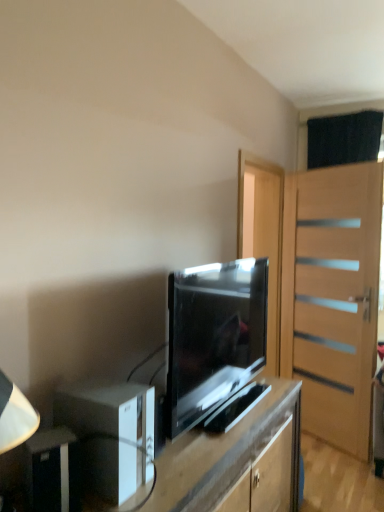
Question: From a real-world perspective, is light brown wooden door at right below matte black tv at center?

Choices:
 (A) no
 (B) yes

Answer: (B)

Question: From the image's perspective, would you say light brown wooden door at right is shown under matte black tv at center?

Choices:
 (A) yes
 (B) no

Answer: (A)

Question: Considering the relative sizes of light brown wooden door at right and matte black tv at center in the image provided, is light brown wooden door at right thinner than matte black tv at center?

Choices:
 (A) yes
 (B) no

Answer: (A)

Question: From a real-world perspective, is light brown wooden door at right positioned over matte black tv at center based on gravity?

Choices:
 (A) no
 (B) yes

Answer: (A)

Question: Is light brown wooden door at right at the left side of matte black tv at center?

Choices:
 (A) yes
 (B) no

Answer: (B)

Question: Is point (79, 504) positioned closer to the camera than point (215, 365)?

Choices:
 (A) farther
 (B) closer

Answer: (B)

Question: In terms of width, does black plastic speaker at lower left, arranged as the second appliance when viewed from the back, look wider or thinner when compared to matte black tv at center?

Choices:
 (A) thin
 (B) wide

Answer: (A)

Question: From a real-world perspective, is black plastic speaker at lower left, the first appliance viewed from the front, above or below matte black tv at center?

Choices:
 (A) below
 (B) above

Answer: (A)

Question: Is black plastic speaker at lower left, the first appliance viewed from the front, taller or shorter than matte black tv at center?

Choices:
 (A) short
 (B) tall

Answer: (A)

Question: From the image's perspective, is matte black tv stand at center above or below black plastic speaker at lower left, arranged as the second appliance when viewed from the back?

Choices:
 (A) above
 (B) below

Answer: (B)

Question: Choose the correct answer: Is matte black tv stand at center inside black plastic speaker at lower left, the first appliance viewed from the front, or outside it?

Choices:
 (A) outside
 (B) inside

Answer: (A)

Question: Is matte black tv stand at center in front of or behind black plastic speaker at lower left, arranged as the second appliance when viewed from the back, in the image?

Choices:
 (A) front
 (B) behind

Answer: (A)

Question: Looking at the image, does matte black tv stand at center seem bigger or smaller compared to black plastic speaker at lower left, arranged as the second appliance when viewed from the back?

Choices:
 (A) big
 (B) small

Answer: (A)

Question: In the image, is matte black tv at center positioned in front of or behind matte black tv stand at center?

Choices:
 (A) front
 (B) behind

Answer: (B)

Question: Which is correct: matte black tv at center is inside matte black tv stand at center, or outside of it?

Choices:
 (A) outside
 (B) inside

Answer: (A)